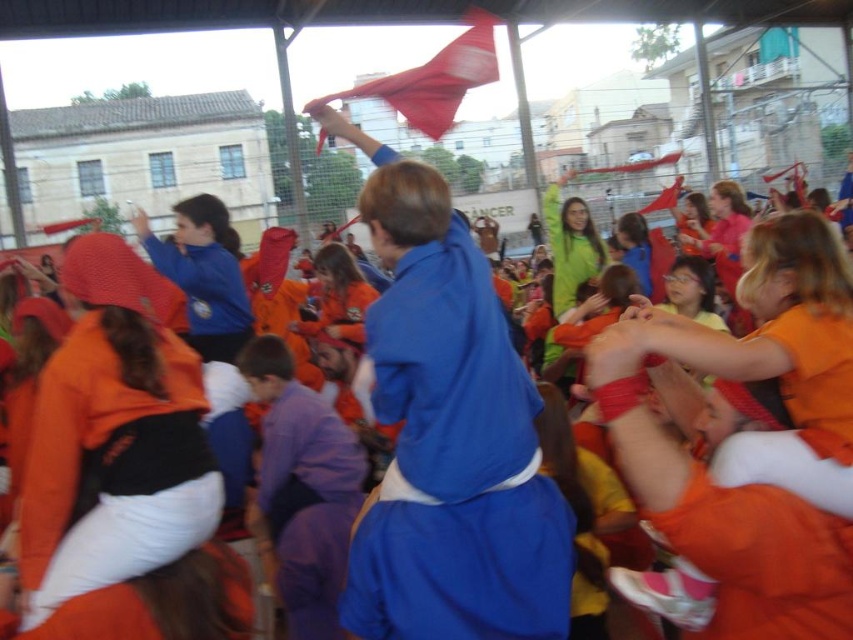
Question: Does blue cotton robe at center appear on the left side of red fabric flag at upper center?

Choices:
 (A) yes
 (B) no

Answer: (A)

Question: Does silky red flag at upper center appear under red fabric flag at upper center?

Choices:
 (A) no
 (B) yes

Answer: (A)

Question: Estimate the real-world distances between objects in this image. Which object is farther from the silky red flag at upper center?

Choices:
 (A) blue cotton robe at center
 (B) red fabric flag at upper center
 (C) orange fleece robe at lower left

Answer: (B)

Question: Which object appears farthest from the camera in this image?

Choices:
 (A) silky red flag at upper center
 (B) orange fleece robe at lower left

Answer: (A)

Question: Is silky red flag at upper center smaller than red fabric flag at upper center?

Choices:
 (A) no
 (B) yes

Answer: (A)

Question: Which object is closer to the camera taking this photo?

Choices:
 (A) blue cotton robe at center
 (B) orange fleece robe at lower left
 (C) silky red flag at upper center
 (D) red fabric flag at upper center

Answer: (B)